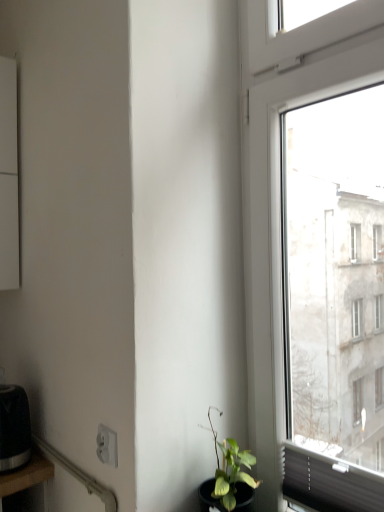
Question: Is black wood table at lower left closer to the viewer compared to white plastic power plugs and sockets at lower left?

Choices:
 (A) yes
 (B) no

Answer: (B)

Question: From the image's perspective, is black wood table at lower left under white plastic power plugs and sockets at lower left?

Choices:
 (A) no
 (B) yes

Answer: (B)

Question: Is black wood table at lower left wider than white plastic power plugs and sockets at lower left?

Choices:
 (A) yes
 (B) no

Answer: (A)

Question: From a real-world perspective, is black wood table at lower left under white plastic power plugs and sockets at lower left?

Choices:
 (A) no
 (B) yes

Answer: (B)

Question: Can you confirm if black wood table at lower left is thinner than white plastic power plugs and sockets at lower left?

Choices:
 (A) yes
 (B) no

Answer: (B)

Question: Is black matte toaster at lower left situated inside white plastic power plugs and sockets at lower left or outside?

Choices:
 (A) outside
 (B) inside

Answer: (A)

Question: From a real-world perspective, is black matte toaster at lower left physically located above or below white plastic power plugs and sockets at lower left?

Choices:
 (A) below
 (B) above

Answer: (A)

Question: Considering the positions of point (1, 403) and point (109, 443), is point (1, 403) closer or farther from the camera than point (109, 443)?

Choices:
 (A) farther
 (B) closer

Answer: (A)

Question: Looking at their shapes, would you say black matte toaster at lower left is wider or thinner than white plastic power plugs and sockets at lower left?

Choices:
 (A) wide
 (B) thin

Answer: (A)

Question: In terms of height, does black matte toaster at lower left look taller or shorter compared to black wood table at lower left?

Choices:
 (A) short
 (B) tall

Answer: (A)

Question: Is black matte toaster at lower left to the left or to the right of black wood table at lower left in the image?

Choices:
 (A) right
 (B) left

Answer: (A)

Question: Looking at their shapes, would you say black matte toaster at lower left is wider or thinner than black wood table at lower left?

Choices:
 (A) thin
 (B) wide

Answer: (A)

Question: From the image's perspective, is black matte toaster at lower left located above or below black wood table at lower left?

Choices:
 (A) below
 (B) above

Answer: (B)

Question: From the image's perspective, is black wood table at lower left located above or below white plastic power plugs and sockets at lower left?

Choices:
 (A) below
 (B) above

Answer: (A)

Question: Is black wood table at lower left bigger or smaller than white plastic power plugs and sockets at lower left?

Choices:
 (A) big
 (B) small

Answer: (A)